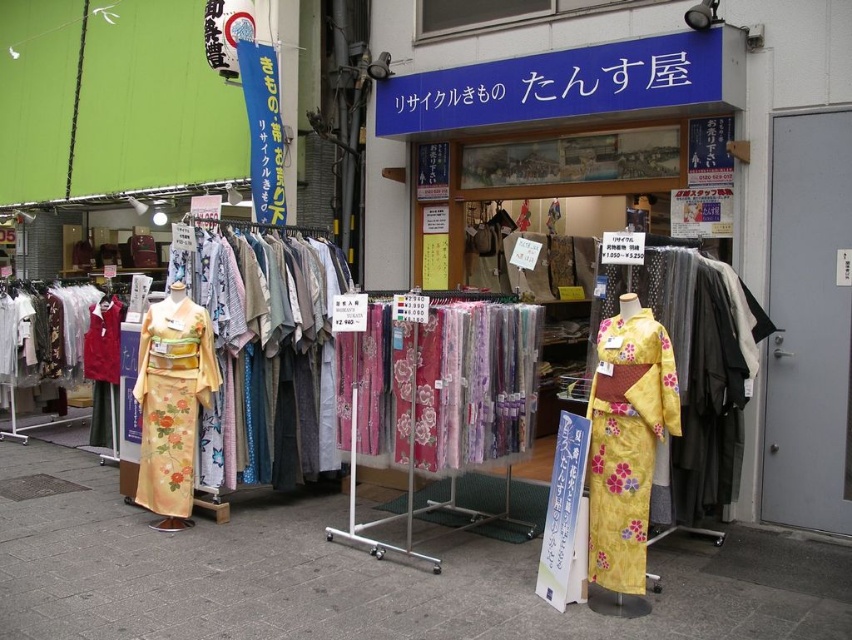
Is floral silk kimono at center below yellow floral silk kimono at center?

Actually, floral silk kimono at center is above yellow floral silk kimono at center.

Between floral silk kimono at center and yellow floral silk kimono at center, which one has less height?

yellow floral silk kimono at center is shorter.

What do you see at coordinates (268, 349) in the screenshot?
I see `floral silk kimono at center` at bounding box center [268, 349].

You are a GUI agent. You are given a task and a screenshot of the screen. Output one action in this format:
    pyautogui.click(x=<x>, y=<y>)
    Task: Click on the floral silk kimono at center
    The width and height of the screenshot is (852, 640).
    Given the screenshot: What is the action you would take?
    pyautogui.click(x=268, y=349)

Who is more forward, (x=271, y=275) or (x=654, y=342)?

Point (x=654, y=342)

Who is lower down, floral silk kimono at center or yellow floral kimono at center?

yellow floral kimono at center

Is point (225, 243) more distant than point (597, 493)?

Yes.

The image size is (852, 640). Identify the location of floral silk kimono at center. (268, 349).

You are a GUI agent. You are given a task and a screenshot of the screen. Output one action in this format:
    pyautogui.click(x=<x>, y=<y>)
    Task: Click on the matte concrete pavement at center
    
    Given the screenshot: What is the action you would take?
    pyautogui.click(x=353, y=576)

Does matte concrete pavement at center appear on the right side of floral silk kimono at center?

In fact, matte concrete pavement at center is to the left of floral silk kimono at center.

Between point (531, 554) and point (321, 241), which one is positioned behind?

Point (321, 241)

Find the location of `matte concrete pavement at center`. matte concrete pavement at center is located at coordinates (x=353, y=576).